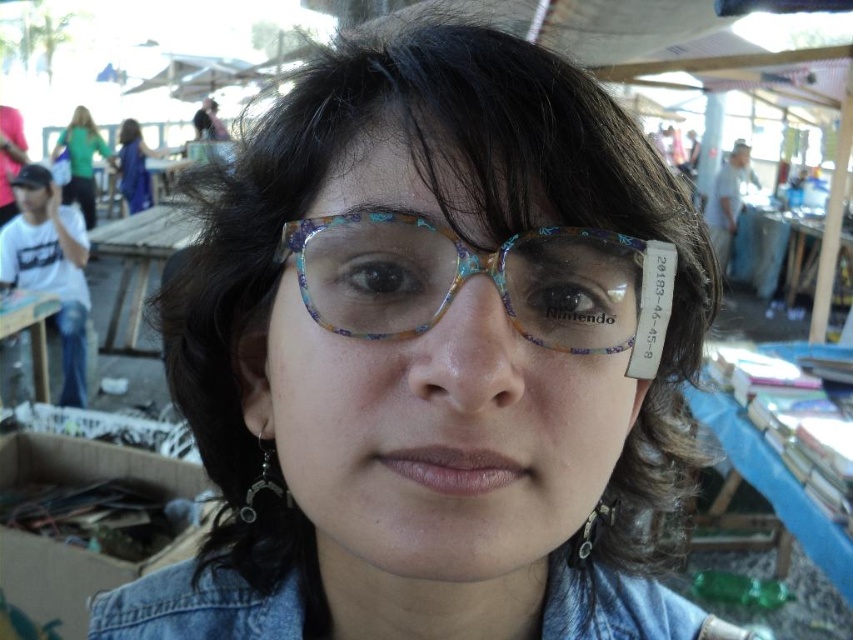
Based on the photo, you are a photographer trying to capture the faded denim jacket at lower right in the center of your photo. Given its current position at point 0.950 on the x axis and 0.231 on the y axis, will you need to adjust your camera to the right or left to frame it better?

The faded denim jacket at lower right is located at point 0.950 on the x axis and 0.231 on the y axis. To center it, you should move the camera to the left since the x coordinate is close to the right edge.